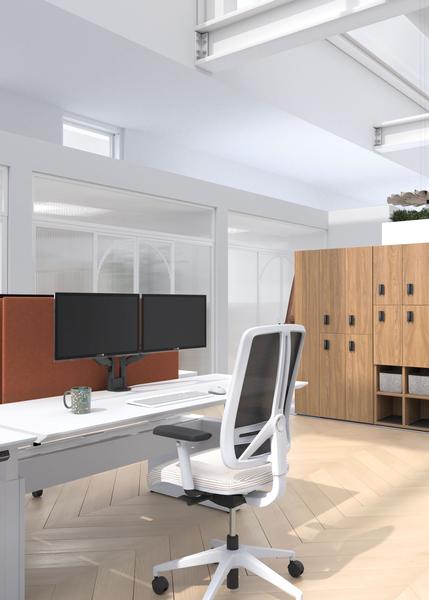
Where is `beam`? Image resolution: width=429 pixels, height=600 pixels. beam is located at coordinates (421, 133), (248, 31).